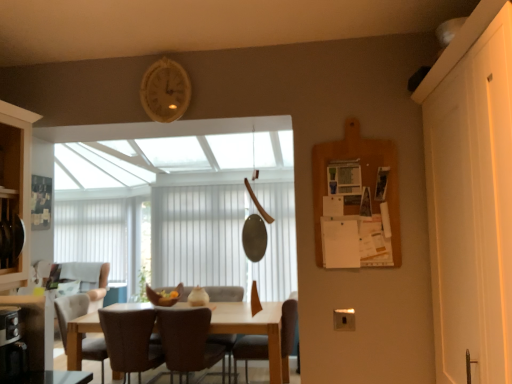
Question: Is brown leather chair at center, which is the third chair in left-to-right order, positioned beyond the bounds of white/textured blind at center?

Choices:
 (A) no
 (B) yes

Answer: (B)

Question: Does brown leather chair at center, which is the third chair in left-to-right order, touch white/textured blind at center?

Choices:
 (A) no
 (B) yes

Answer: (A)

Question: Is brown leather chair at center, acting as the 2th chair starting from the right, closer to the viewer compared to white/textured blind at center?

Choices:
 (A) yes
 (B) no

Answer: (A)

Question: Is brown leather chair at center, acting as the 2th chair starting from the right, oriented away from white/textured blind at center?

Choices:
 (A) no
 (B) yes

Answer: (A)

Question: Does brown leather chair at center, which is the third chair in left-to-right order, turn towards white/textured blind at center?

Choices:
 (A) no
 (B) yes

Answer: (B)

Question: In terms of height, does white matte door at right look taller or shorter compared to wooden clock at upper center?

Choices:
 (A) tall
 (B) short

Answer: (A)

Question: Considering the relative positions of white matte door at right and wooden clock at upper center in the image provided, is white matte door at right to the left or to the right of wooden clock at upper center?

Choices:
 (A) left
 (B) right

Answer: (B)

Question: Is white matte door at right in front of or behind wooden clock at upper center in the image?

Choices:
 (A) front
 (B) behind

Answer: (A)

Question: Is white matte door at right inside or outside of wooden clock at upper center?

Choices:
 (A) inside
 (B) outside

Answer: (B)

Question: From a real-world perspective, is wooden clock at upper center positioned above or below brown leather chair at lower left, which is counted as the 4th chair, starting from the right?

Choices:
 (A) above
 (B) below

Answer: (A)

Question: Is wooden clock at upper center to the left or to the right of brown leather chair at lower left, which is counted as the 4th chair, starting from the right, in the image?

Choices:
 (A) left
 (B) right

Answer: (B)

Question: From their relative heights in the image, would you say wooden clock at upper center is taller or shorter than brown leather chair at lower left, the first chair positioned from the left?

Choices:
 (A) tall
 (B) short

Answer: (B)

Question: Is wooden clock at upper center wider or thinner than brown leather chair at lower left, which is counted as the 4th chair, starting from the right?

Choices:
 (A) wide
 (B) thin

Answer: (B)

Question: From the image's perspective, relative to brown leather chair at center, the first chair positioned from the right, is brown leather chair at center, acting as the 2th chair starting from the right, above or below?

Choices:
 (A) below
 (B) above

Answer: (B)

Question: Is brown leather chair at center, acting as the 2th chair starting from the right, bigger or smaller than brown leather chair at center, the first chair positioned from the right?

Choices:
 (A) small
 (B) big

Answer: (A)